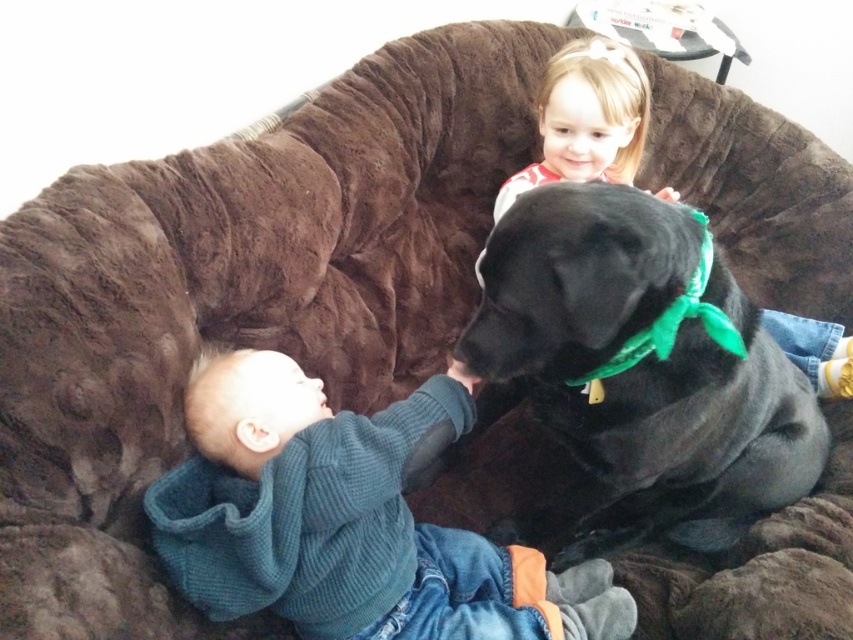
Does point (308, 573) come in front of point (556, 106)?

Yes, point (308, 573) is closer to viewer.

The width and height of the screenshot is (853, 640). Identify the location of knitted teal sweater at lower left. (347, 518).

Measure the distance between point (331,602) and camera.

Point (331,602) and camera are 3.49 feet apart.

Locate an element on the screen. knitted teal sweater at lower left is located at coordinates (347, 518).

Consider the image. Which is more to the right, black matte dog at center or knitted teal sweater at lower left?

From the viewer's perspective, black matte dog at center appears more on the right side.

Who is more distant from viewer, (654, 211) or (263, 524)?

The point (263, 524) is behind.

Is point (677, 404) positioned before point (387, 605)?

That is True.

In order to click on black matte dog at center in this screenshot , I will do 636,374.

Does black matte dog at center have a greater width compared to blonde hair at upper right?

Yes.

Does black matte dog at center come in front of blonde hair at upper right?

Yes, it is.

Between point (589, 534) and point (602, 76), which one is positioned in front?

Positioned in front is point (589, 534).

At what (x,y) coordinates should I click in order to perform the action: click on black matte dog at center. Please return your answer as a coordinate pair (x, y). Looking at the image, I should click on (636, 374).